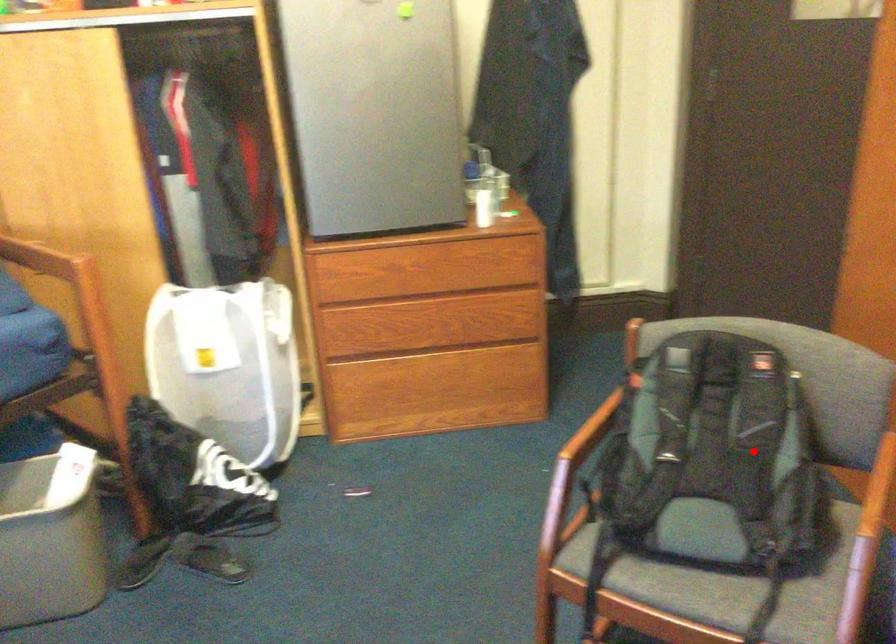
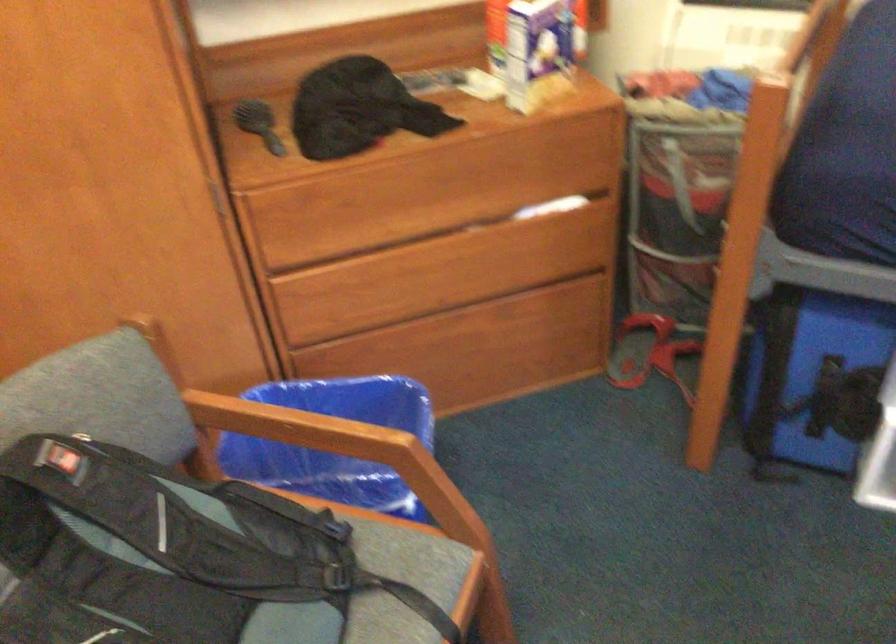
Locate, in the second image, the point that corresponds to the highlighted location in the first image.

(162, 543)